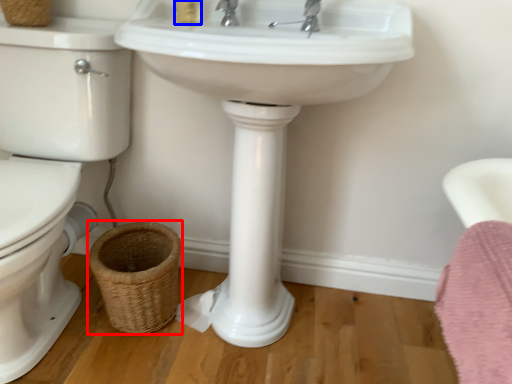
Question: Which point is further to the camera, basket (highlighted by a red box) or toiletry (highlighted by a blue box)?

Choices:
 (A) basket
 (B) toiletry

Answer: (A)